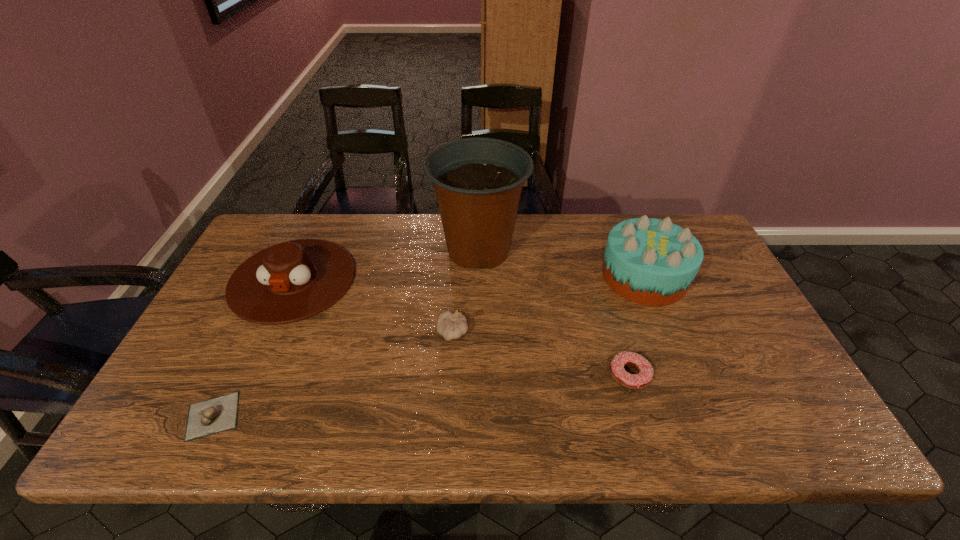
You are a GUI agent. You are given a task and a screenshot of the screen. Output one action in this format:
    pyautogui.click(x=<x>, y=<y>)
    Task: Click on the free space that satisfies the following two spatial constraints: 1. on the front-facing side of the cowboy hat; 2. on the right side of the doughnut
    The image size is (960, 540).
    Given the screenshot: What is the action you would take?
    pyautogui.click(x=250, y=375)

Where is `blank space that satisfies the following two spatial constraints: 1. on the front-facing side of the cowboy hat; 2. on the left side of the farther garlic`? This screenshot has width=960, height=540. blank space that satisfies the following two spatial constraints: 1. on the front-facing side of the cowboy hat; 2. on the left side of the farther garlic is located at coordinates (269, 333).

Where is `free spot that satisfies the following two spatial constraints: 1. on the back side of the fifth tallest object; 2. on the right side of the cake`? This screenshot has width=960, height=540. free spot that satisfies the following two spatial constraints: 1. on the back side of the fifth tallest object; 2. on the right side of the cake is located at coordinates (601, 276).

Where is `free location that satisfies the following two spatial constraints: 1. on the front-facing side of the doughnut; 2. on the left side of the cowboy hat`? free location that satisfies the following two spatial constraints: 1. on the front-facing side of the doughnut; 2. on the left side of the cowboy hat is located at coordinates (250, 375).

Where is `free location that satisfies the following two spatial constraints: 1. on the front-facing side of the cowboy hat; 2. on the left side of the taller garlic`? free location that satisfies the following two spatial constraints: 1. on the front-facing side of the cowboy hat; 2. on the left side of the taller garlic is located at coordinates click(x=269, y=333).